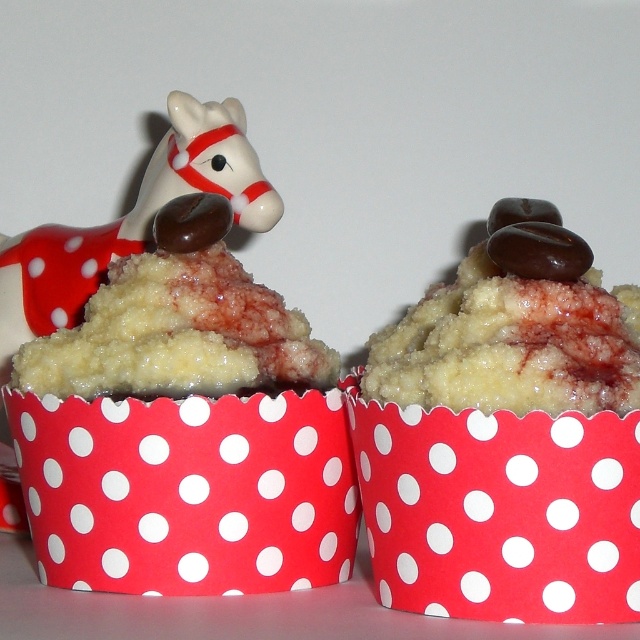
You are standing in front of the cupcakes and want to place a small decoration at a specific location. If you have to choose between placing it at point A at coordinates point(140,273) or point B at coordinates point(515,470), which point would be closer to the front of the cupcakes?

Point B at coordinates point(515,470) is closer to the front of the cupcakes because it is in front of point A at coordinates point(140,273).

Please look at the image and identify the object located at the coordinates point (184, 429). Which object is it?

The point (184, 429) indicates the matte white cupcake at upper left.